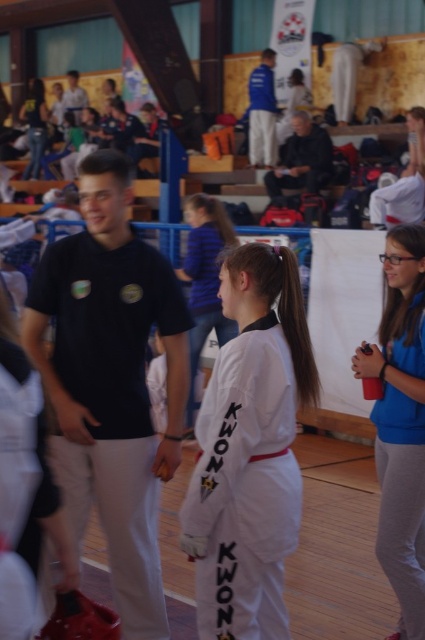
Can you confirm if blue fabric shirt at right is smaller than matte black karate uniform at upper left?

Yes.

Who is higher up, blue fabric shirt at right or matte black karate uniform at upper left?

Positioned higher is matte black karate uniform at upper left.

Is point (397, 243) behind point (33, 129)?

No, it is in front of (33, 129).

Where is `blue fabric shirt at right`? This screenshot has height=640, width=425. blue fabric shirt at right is located at coordinates (401, 422).

Which is more to the left, white matte karate uniform at center or matte black karate uniform at upper left?

From the viewer's perspective, matte black karate uniform at upper left appears more on the left side.

Does white matte karate uniform at center appear on the right side of matte black karate uniform at upper left?

Yes, white matte karate uniform at center is to the right of matte black karate uniform at upper left.

What do you see at coordinates (249, 451) in the screenshot? I see `white matte karate uniform at center` at bounding box center [249, 451].

Where is `white matte karate uniform at center`? The width and height of the screenshot is (425, 640). white matte karate uniform at center is located at coordinates (249, 451).

Can you confirm if white matte karate uniform at center is positioned below blue fabric shirt at right?

Actually, white matte karate uniform at center is above blue fabric shirt at right.

Does point (292, 349) lie in front of point (408, 611)?

Yes, it is.

I want to click on white matte karate uniform at center, so click(249, 451).

At what (x,y) coordinates should I click in order to perform the action: click on white matte karate uniform at center. Please return your answer as a coordinate pair (x, y). Looking at the image, I should click on (249, 451).